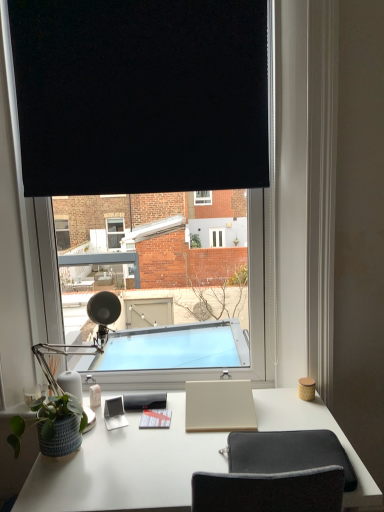
Question: Can you confirm if white matte desk at center is positioned to the left of black matte window at center?

Choices:
 (A) no
 (B) yes

Answer: (A)

Question: Is white matte desk at center thinner than black matte window at center?

Choices:
 (A) yes
 (B) no

Answer: (B)

Question: Is white matte desk at center oriented towards black matte window at center?

Choices:
 (A) no
 (B) yes

Answer: (A)

Question: From the image's perspective, is white matte desk at center beneath black matte window at center?

Choices:
 (A) yes
 (B) no

Answer: (A)

Question: Is white matte desk at center to the right of black matte window at center from the viewer's perspective?

Choices:
 (A) no
 (B) yes

Answer: (B)

Question: Considering the relative sizes of white matte desk at center and black matte window at center in the image provided, is white matte desk at center smaller than black matte window at center?

Choices:
 (A) no
 (B) yes

Answer: (B)

Question: Is matte gray notepad at center, which is the 3th notepad from right to left, oriented towards black fabric at upper center?

Choices:
 (A) no
 (B) yes

Answer: (A)

Question: From the image's perspective, does matte gray notepad at center, placed as the 1th notepad when sorted from left to right, appear higher than black fabric at upper center?

Choices:
 (A) no
 (B) yes

Answer: (A)

Question: Can you confirm if matte gray notepad at center, which is the 3th notepad from right to left, is positioned to the right of black fabric at upper center?

Choices:
 (A) yes
 (B) no

Answer: (A)

Question: Does matte gray notepad at center, which is the 3th notepad from right to left, touch black fabric at upper center?

Choices:
 (A) yes
 (B) no

Answer: (B)

Question: Does matte gray notepad at center, which is the 3th notepad from right to left, have a greater width compared to black fabric at upper center?

Choices:
 (A) no
 (B) yes

Answer: (B)

Question: Is matte gray notepad at center, placed as the 1th notepad when sorted from left to right, positioned in front of black fabric at upper center?

Choices:
 (A) no
 (B) yes

Answer: (A)

Question: From the image's perspective, is beige matte notepad at center, marked as the 3th notepad in a left-to-right arrangement, on black matte window at center?

Choices:
 (A) yes
 (B) no

Answer: (B)